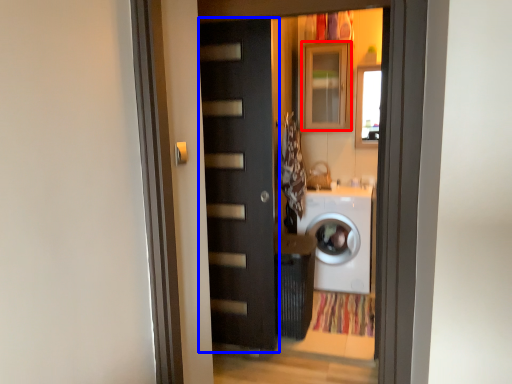
Question: Which object is further to the camera taking this photo, cabinetry (highlighted by a red box) or door (highlighted by a blue box)?

Choices:
 (A) cabinetry
 (B) door

Answer: (A)